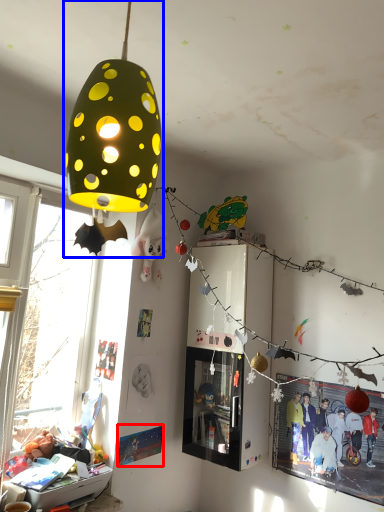
Question: Which point is closer to the camera, poster page (highlighted by a red box) or lamp (highlighted by a blue box)?

Choices:
 (A) poster page
 (B) lamp

Answer: (B)